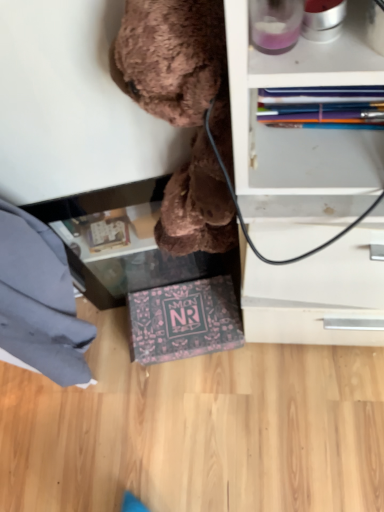
Question: Can you confirm if transparent glass table at lower center is shorter than brown plush toy at upper center?

Choices:
 (A) no
 (B) yes

Answer: (B)

Question: Considering the relative sizes of transparent glass table at lower center and brown plush toy at upper center in the image provided, is transparent glass table at lower center taller than brown plush toy at upper center?

Choices:
 (A) no
 (B) yes

Answer: (A)

Question: Is transparent glass table at lower center further to camera compared to brown plush toy at upper center?

Choices:
 (A) yes
 (B) no

Answer: (A)

Question: Is transparent glass table at lower center facing towards brown plush toy at upper center?

Choices:
 (A) no
 (B) yes

Answer: (A)

Question: From the image's perspective, is transparent glass table at lower center below brown plush toy at upper center?

Choices:
 (A) yes
 (B) no

Answer: (A)

Question: Based on their sizes in the image, would you say transparent glass table at lower center is bigger or smaller than dark blue fabric at lower left?

Choices:
 (A) big
 (B) small

Answer: (A)

Question: From the image's perspective, relative to dark blue fabric at lower left, is transparent glass table at lower center above or below?

Choices:
 (A) above
 (B) below

Answer: (A)

Question: Does point (215, 262) appear closer or farther from the camera than point (21, 232)?

Choices:
 (A) closer
 (B) farther

Answer: (B)

Question: Is transparent glass table at lower center taller or shorter than dark blue fabric at lower left?

Choices:
 (A) short
 (B) tall

Answer: (A)

Question: Is transparent glass table at lower center in front of or behind brown plush toy at upper center in the image?

Choices:
 (A) front
 (B) behind

Answer: (B)

Question: In terms of width, does transparent glass table at lower center look wider or thinner when compared to brown plush toy at upper center?

Choices:
 (A) thin
 (B) wide

Answer: (B)

Question: From the image's perspective, relative to brown plush toy at upper center, is transparent glass table at lower center above or below?

Choices:
 (A) above
 (B) below

Answer: (B)

Question: In terms of size, does transparent glass table at lower center appear bigger or smaller than brown plush toy at upper center?

Choices:
 (A) small
 (B) big

Answer: (B)

Question: Considering their positions, is dark blue fabric at lower left located in front of or behind brown plush toy at upper center?

Choices:
 (A) behind
 (B) front

Answer: (A)

Question: Is dark blue fabric at lower left taller or shorter than brown plush toy at upper center?

Choices:
 (A) tall
 (B) short

Answer: (A)